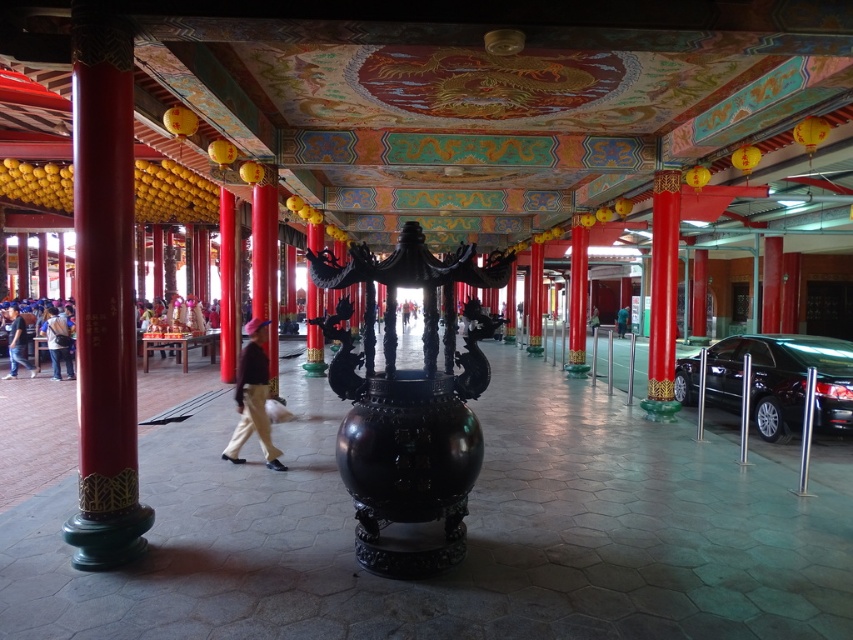
You are an interior designer planning to place a new decorative item in the grand hall. You have a small statue that is the same size as the dark blue jeans at lower left. Can the statue fit in the space where the black metallic car at right is currently located?

The black metallic car at right is larger in size than the dark blue jeans at lower left. Since the statue is the same size as the dark blue jeans at lower left, it would fit in the space where the black metallic car at right is located because the car takes up more space, leaving enough room for the smaller statue.

You are an event planner setting up a banquet in the grand hall. You need to place a 3.5 meter long table between the black polished vase at center and the nearest pillar. Is there enough space?

The distance between the black polished vase at center and the nearest pillar is 3.41 meters. Since the table is 3.5 meters long, it is slightly too long to fit between them, so there isn not enough space.